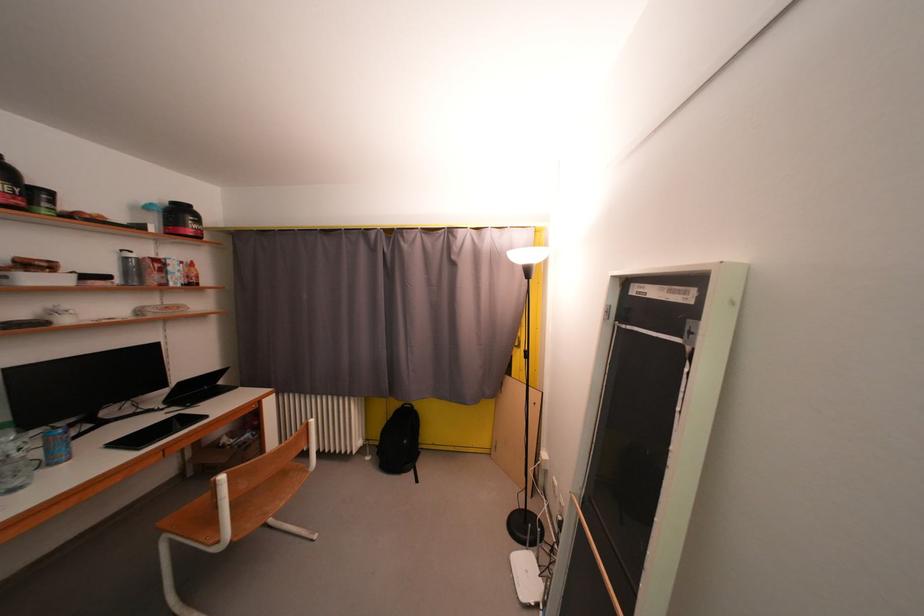
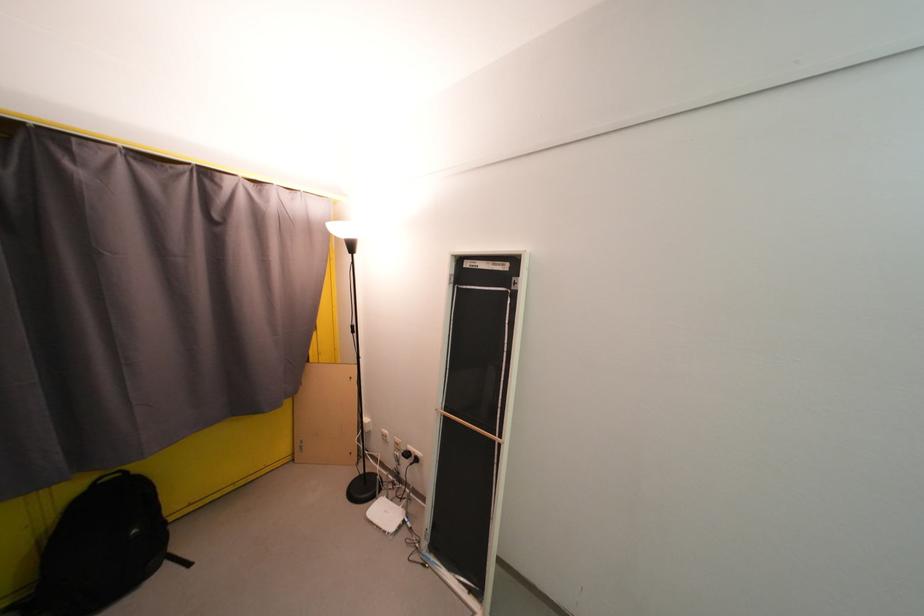
Question: The camera is either moving clockwise (left) or counter-clockwise (right) around the object. The first image is from the beginning of the video and the second image is from the end. Is the camera moving left or right when shooting the video?

Choices:
 (A) Left
 (B) Right

Answer: (A)